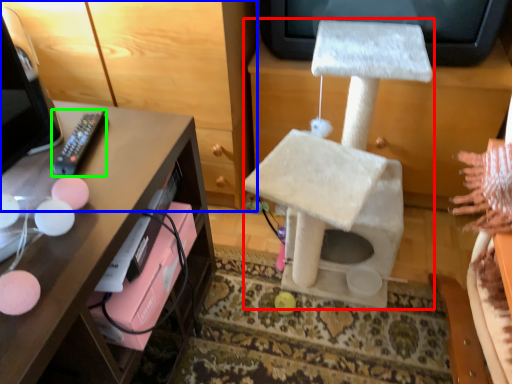
Question: Which object is the farthest from swivel chair (highlighted by a red box)? Choose among these: furniture (highlighted by a blue box) or remote (highlighted by a green box).

Choices:
 (A) furniture
 (B) remote

Answer: (B)